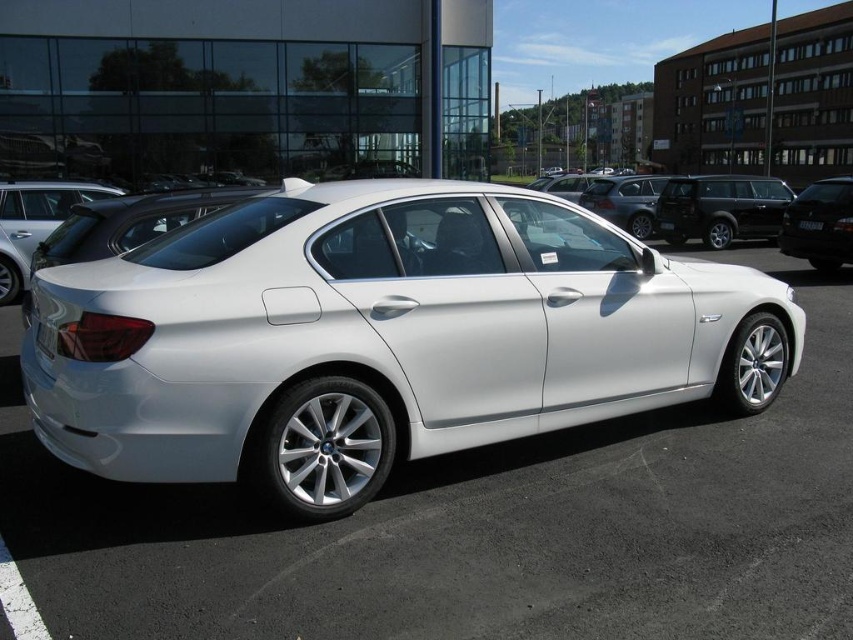
Is white metallic car at center wider than black plastic license plate at center?

Yes, white metallic car at center is wider than black plastic license plate at center.

Measure the distance from white metallic car at center to black plastic license plate at center.

white metallic car at center and black plastic license plate at center are 10.19 meters apart.

Consider the image. Who is more distant from viewer, (529, 566) or (813, 228)?

Positioned behind is point (813, 228).

You are a GUI agent. You are given a task and a screenshot of the screen. Output one action in this format:
    pyautogui.click(x=<x>, y=<y>)
    Task: Click on the white metallic car at center
    This screenshot has height=640, width=853.
    Given the screenshot: What is the action you would take?
    pyautogui.click(x=479, y=525)

Who is positioned more to the right, shiny black suv at center or satin black sedan at right?

shiny black suv at center is more to the right.

Does shiny black suv at center have a lesser width compared to satin black sedan at right?

No, shiny black suv at center is not thinner than satin black sedan at right.

This screenshot has width=853, height=640. In order to click on shiny black suv at center in this screenshot , I will do `click(721, 209)`.

Identify the location of shiny black suv at center. This screenshot has height=640, width=853. (721, 209).

Based on the photo, does shiny black suv at center appear under black plastic license plate at center?

Incorrect, shiny black suv at center is not positioned below black plastic license plate at center.

Is point (706, 212) in front of point (814, 221)?

No, (706, 212) is behind (814, 221).

Locate an element on the screen. shiny black suv at center is located at coordinates (721, 209).